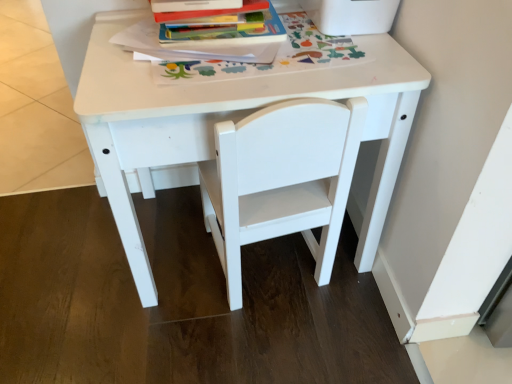
Question: Should I look upward or downward to see white matte table at center?

Choices:
 (A) down
 (B) up

Answer: (B)

Question: Should I look upward or downward to see white matte chair at center?

Choices:
 (A) up
 (B) down

Answer: (A)

Question: Is hardcover book at upper center positioned with its back to white matte table at center?

Choices:
 (A) no
 (B) yes

Answer: (A)

Question: Is white matte table at center a part of hardcover book at upper center?

Choices:
 (A) yes
 (B) no

Answer: (B)

Question: Does hardcover book at upper center have a larger size compared to white matte table at center?

Choices:
 (A) yes
 (B) no

Answer: (B)

Question: Could you tell me if hardcover book at upper center is turned towards white matte table at center?

Choices:
 (A) no
 (B) yes

Answer: (A)

Question: From a real-world perspective, is hardcover book at upper center positioned under white matte table at center based on gravity?

Choices:
 (A) yes
 (B) no

Answer: (B)

Question: Can you confirm if hardcover book at upper center is positioned to the right of white matte table at center?

Choices:
 (A) yes
 (B) no

Answer: (B)

Question: From a real-world perspective, is white matte chair at center under hardcover book at upper center?

Choices:
 (A) no
 (B) yes

Answer: (B)

Question: Could you tell me if white matte chair at center is facing hardcover book at upper center?

Choices:
 (A) yes
 (B) no

Answer: (A)

Question: Is white matte chair at center located outside hardcover book at upper center?

Choices:
 (A) no
 (B) yes

Answer: (B)

Question: Is white matte chair at center at the right side of hardcover book at upper center?

Choices:
 (A) no
 (B) yes

Answer: (B)

Question: From the image's perspective, is white matte chair at center beneath hardcover book at upper center?

Choices:
 (A) yes
 (B) no

Answer: (A)

Question: Does white matte chair at center appear on the left side of hardcover book at upper center?

Choices:
 (A) no
 (B) yes

Answer: (A)

Question: From a real-world perspective, does white matte chair at center stand above white matte table at center?

Choices:
 (A) yes
 (B) no

Answer: (B)